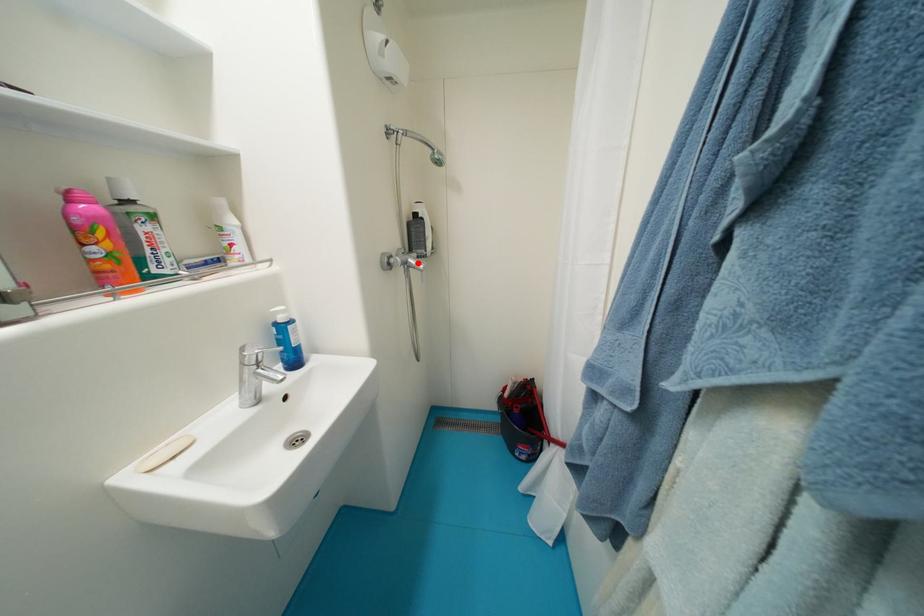
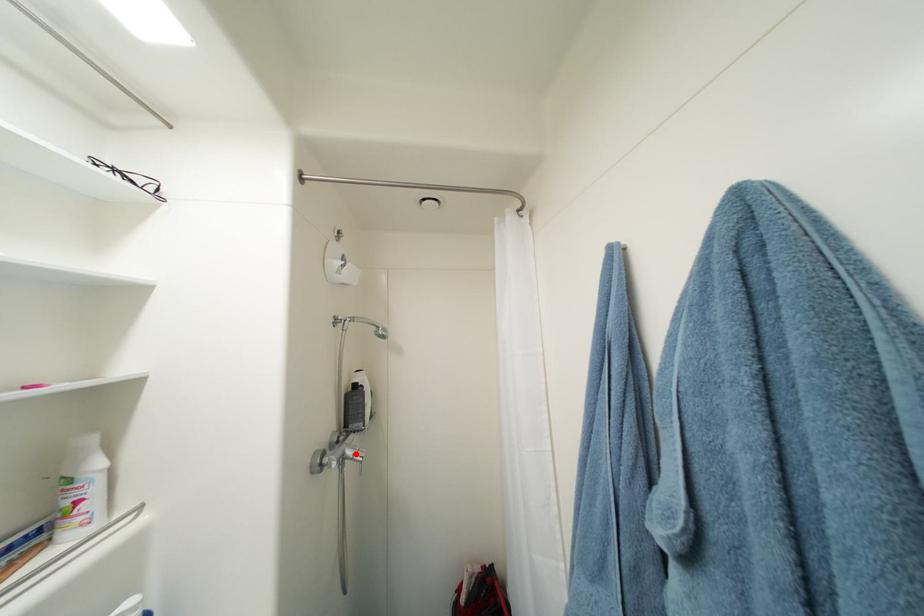
From the picture: I am providing you with two images of the same scene from different viewpoints. A red point is marked on the first image and another point is marked on the second image. Are the points marked in image1 and image2 representing the same 3D position?

Yes